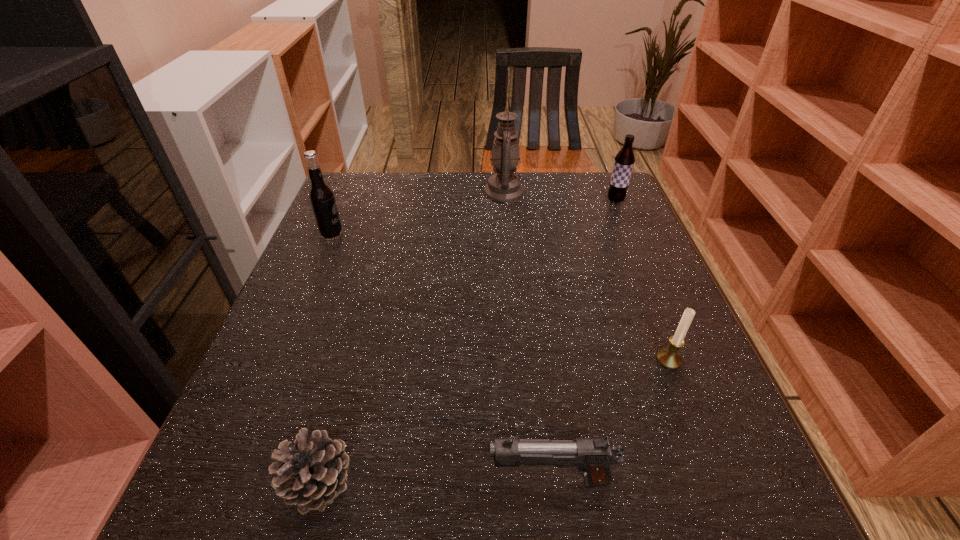
Where is `free space at the far left corner`? This screenshot has height=540, width=960. free space at the far left corner is located at coordinates (360, 210).

Find the location of a particular element. Image resolution: width=960 pixels, height=540 pixels. empty space between the pinecone and the gun is located at coordinates (435, 481).

Find the location of a particular element. free space between the oil lamp and the fifth object from right to left is located at coordinates (412, 337).

Where is `unoccupied position between the second object from left to right and the fifth shortest object`? unoccupied position between the second object from left to right and the fifth shortest object is located at coordinates (325, 359).

This screenshot has height=540, width=960. In order to click on vacant point located between the fifth shortest object and the tallest object in this screenshot , I will do `click(418, 213)`.

I want to click on empty space between the fourth farthest object and the fifth object from right to left, so click(494, 421).

Find the location of a particular element. free spot between the shorter root beer and the gun is located at coordinates (583, 340).

Identify the location of free space between the right root beer and the nearer root beer. (473, 218).

Identify the location of unoccupied position between the fifth object from right to left and the fifth shortest object. (325, 359).

You are a GUI agent. You are given a task and a screenshot of the screen. Output one action in this format:
    pyautogui.click(x=<x>, y=<y>)
    Task: Click on the vacant area that lies between the candle holder and the taller root beer
    This screenshot has width=960, height=540.
    Given the screenshot: What is the action you would take?
    pyautogui.click(x=500, y=298)